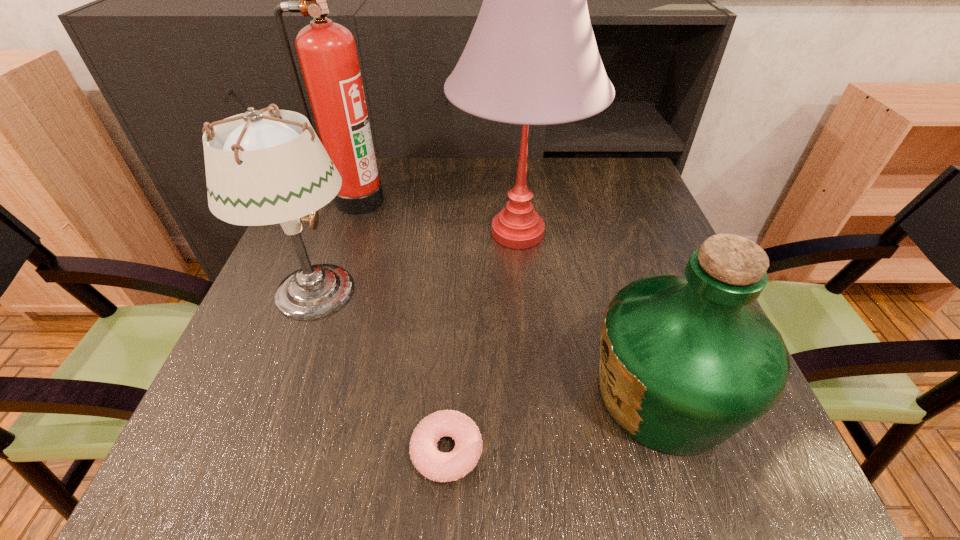
Find the location of a particular element. The width and height of the screenshot is (960, 540). free area in between the lampshade and the table lamp is located at coordinates (417, 262).

Locate an element on the screen. free space between the doughnut and the table lamp is located at coordinates (483, 342).

In order to click on vacant area that lies between the liquor and the doughnut in this screenshot , I will do `click(555, 423)`.

What are the coordinates of `free space between the second shortest object and the third tallest object` in the screenshot? It's located at (489, 344).

What are the coordinates of `unoccupied area between the table lamp and the lampshade` in the screenshot? It's located at (417, 262).

I want to click on free spot between the liquor and the table lamp, so click(590, 314).

Locate an element on the screen. The image size is (960, 540). empty space between the fire extinguisher and the lampshade is located at coordinates (336, 247).

Locate an element on the screen. free point between the shortest object and the fire extinguisher is located at coordinates (402, 326).

Identify the location of empty space that is in between the third tallest object and the table lamp. (417, 262).

Identify which object is the nearest to the lampshade. Please provide its 2D coordinates. Your answer should be formatted as a tuple, i.e. [(x, y)], where the tuple contains the x and y coordinates of a point satisfying the conditions above.

[(327, 53)]